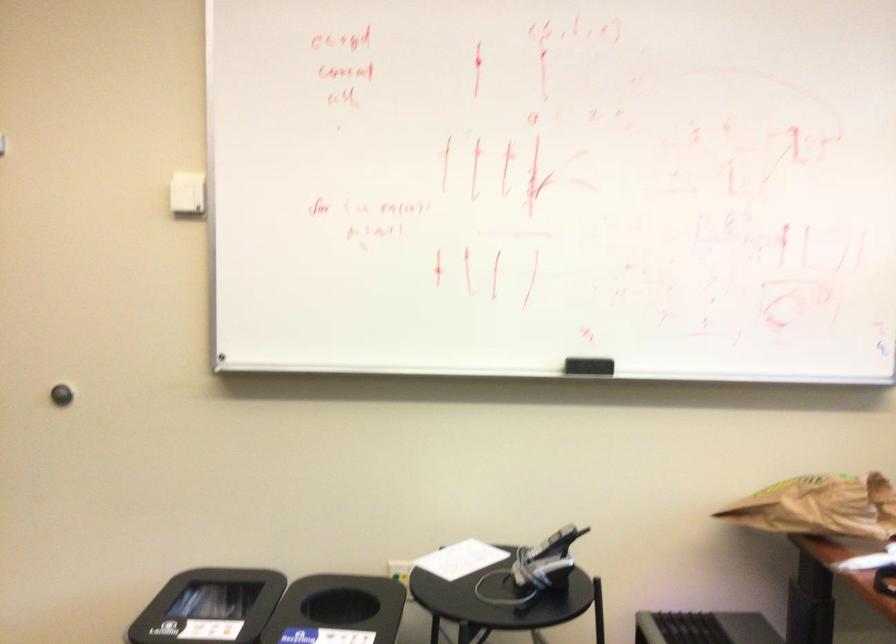
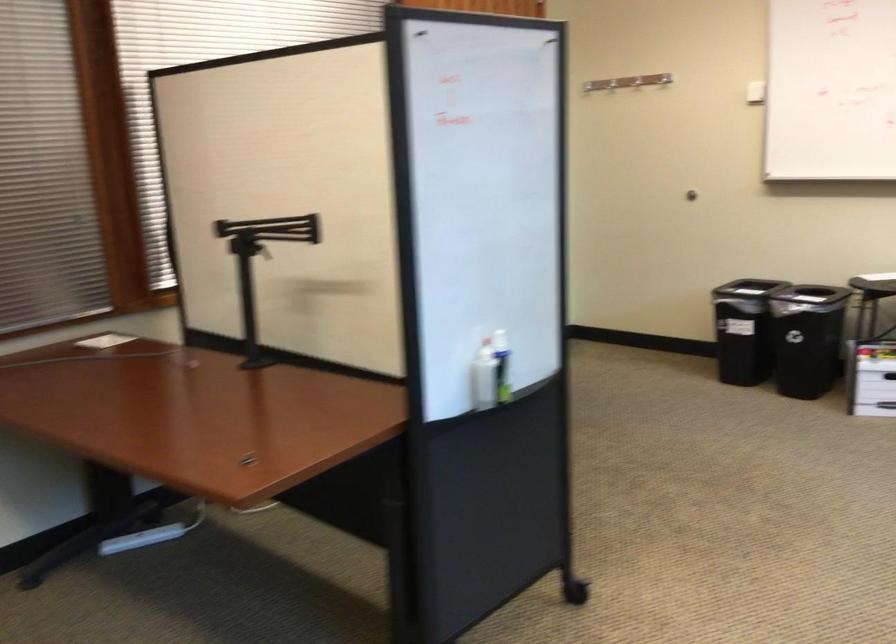
Where in the second image is the point corresponding to [110,156] from the first image?

(636, 82)